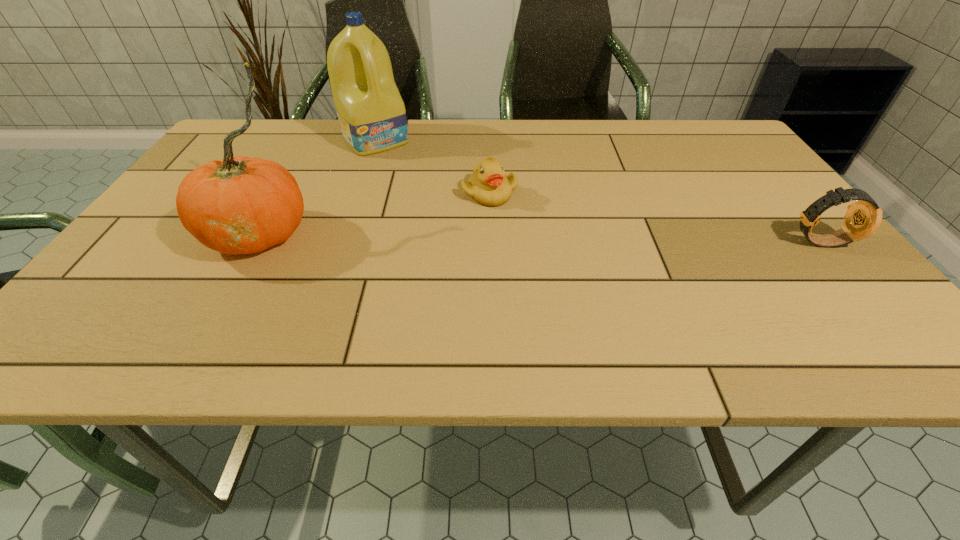
The image size is (960, 540). Identify the location of free spot between the watch and the detergent. (597, 191).

Find the location of a particular element. free spot between the second object from right to left and the pumpkin is located at coordinates (374, 213).

Find the location of a particular element. object that is the second nearest to the pumpkin is located at coordinates (488, 185).

The image size is (960, 540). What are the coordinates of `object that is the third closest one to the pumpkin` in the screenshot? It's located at (863, 218).

Locate an element on the screen. Image resolution: width=960 pixels, height=540 pixels. free space that satisfies the following two spatial constraints: 1. on the front side of the duckling; 2. on the face of the third tallest object is located at coordinates (491, 241).

Image resolution: width=960 pixels, height=540 pixels. I want to click on free space that satisfies the following two spatial constraints: 1. on the front side of the detergent; 2. on the face of the second shortest object, so click(340, 241).

Locate an element on the screen. This screenshot has width=960, height=540. free space that satisfies the following two spatial constraints: 1. on the front side of the pumpkin; 2. on the face of the watch is located at coordinates (254, 241).

Where is `free space that satisfies the following two spatial constraints: 1. on the front side of the pumpkin; 2. on the face of the watch`? The image size is (960, 540). free space that satisfies the following two spatial constraints: 1. on the front side of the pumpkin; 2. on the face of the watch is located at coordinates (x=254, y=241).

This screenshot has width=960, height=540. What are the coordinates of `vacant space that satisfies the following two spatial constraints: 1. on the front side of the second shortest object; 2. on the face of the pumpkin` in the screenshot? It's located at (254, 241).

Identify the location of vacant region that satisfies the following two spatial constraints: 1. on the front side of the second shortest object; 2. on the face of the farthest object. The image size is (960, 540). (340, 241).